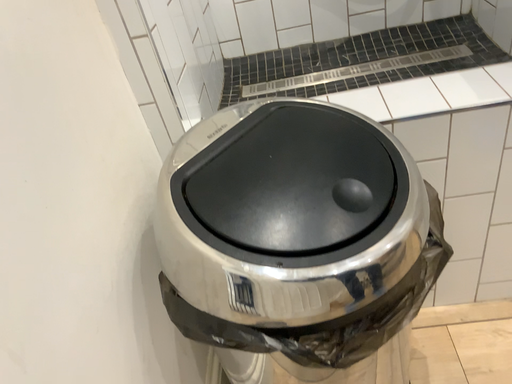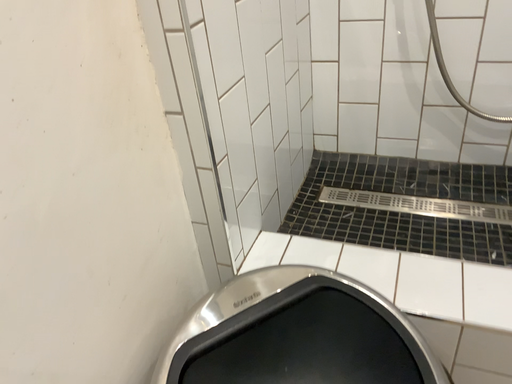
Question: How did the camera likely rotate when shooting the video?

Choices:
 (A) rotated left
 (B) rotated right

Answer: (A)